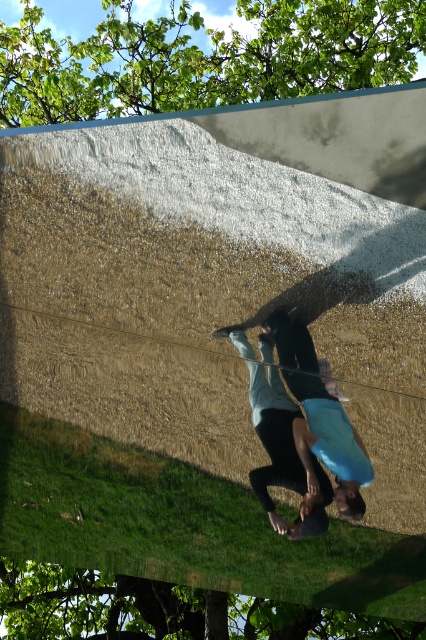
Is point (25, 1) positioned after point (339, 440)?

Yes, point (25, 1) is farther from viewer.

Does green leafy tree at upper center have a smaller size compared to blue matte surfboard at center?

Incorrect, green leafy tree at upper center is not smaller in size than blue matte surfboard at center.

Is point (71, 52) farther from camera compared to point (344, 420)?

Yes.

Find the location of `green leafy tree at upper center`. green leafy tree at upper center is located at coordinates (204, 58).

Which of these two, green leafy tree at upper left or blue matte surfboard at center, stands taller?

Standing taller between the two is green leafy tree at upper left.

Is green leafy tree at upper left taller than blue matte surfboard at center?

Yes.

Identify the location of green leafy tree at upper left. Image resolution: width=426 pixels, height=640 pixels. (161, 609).

Between point (29, 561) and point (247, 349), which one is positioned in front?

Point (247, 349) is in front.

The height and width of the screenshot is (640, 426). Describe the element at coordinates (161, 609) in the screenshot. I see `green leafy tree at upper left` at that location.

In order to click on green leafy tree at upper left in this screenshot , I will do `click(161, 609)`.